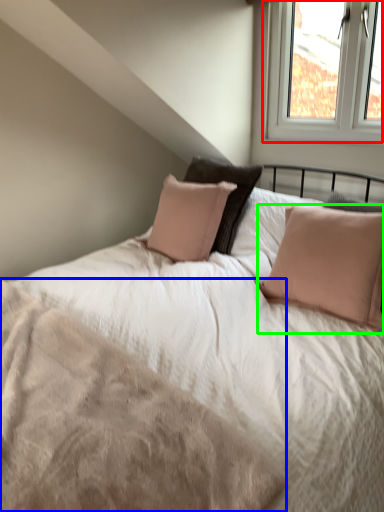
Question: Which object is the closest to the window (highlighted by a red box)? Choose among these: mattress (highlighted by a blue box) or pillow (highlighted by a green box).

Choices:
 (A) mattress
 (B) pillow

Answer: (B)